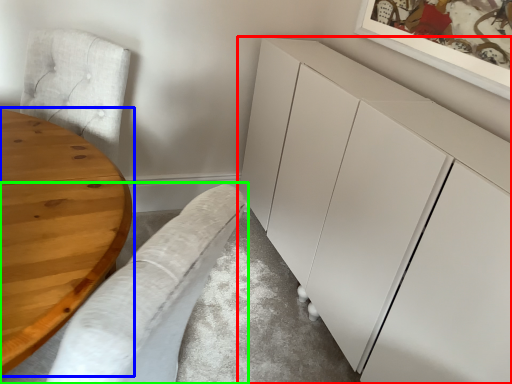
Question: Which object is the farthest from cabinetry (highlighted by a red box)? Choose among these: table (highlighted by a blue box) or couch (highlighted by a green box).

Choices:
 (A) table
 (B) couch

Answer: (A)